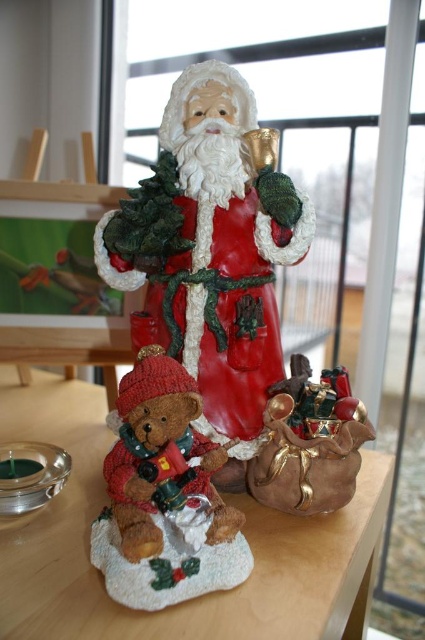
You are setting up a Christmas display and want to ensure proper placement. Since you have a limited space, you need to know if the red glossy santa claus at center can be placed on the brown matte table at center without overhanging. Can you confirm if the santa claus is positioned on the table?

The red glossy santa claus at center is located above brown matte table at center, so yes, it is positioned on the table and does not overhang.

You are setting up a Christmas display and want to ensure the red glossy Santa Claus at center is visible from above the knitted teddy bear at lower left. Is the positioning correct?

Yes, the positioning is correct because the red glossy Santa Claus at center is located above the knitted teddy bear at lower left, ensuring visibility from above.